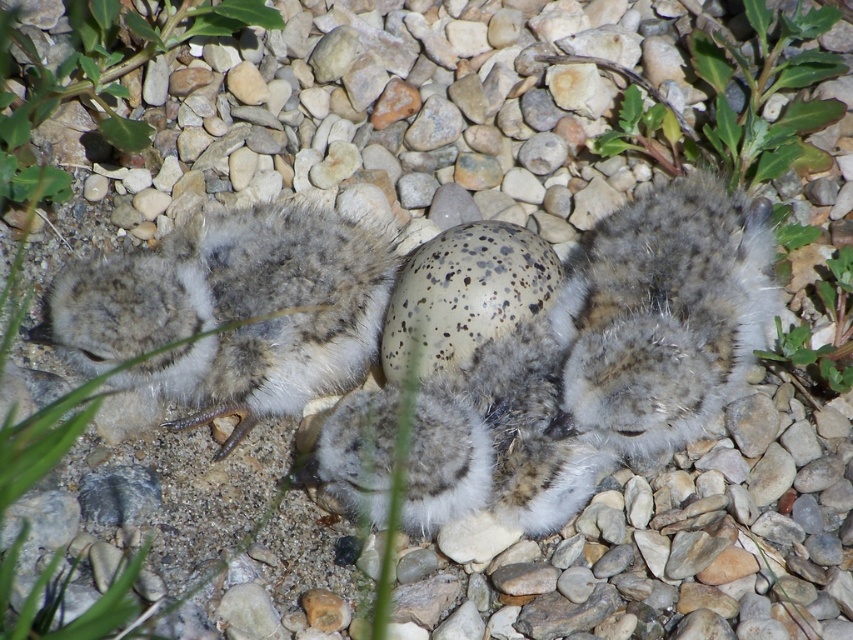
Does soft gray downy chick at center appear on the right side of fuzzy gray bird at center?

No, soft gray downy chick at center is not to the right of fuzzy gray bird at center.

Between point (267, 259) and point (759, 243), which one is positioned behind?

The point (759, 243) is more distant.

Is point (158, 323) positioned after point (590, 280)?

No.

Find the location of a particular element. soft gray downy chick at center is located at coordinates (231, 310).